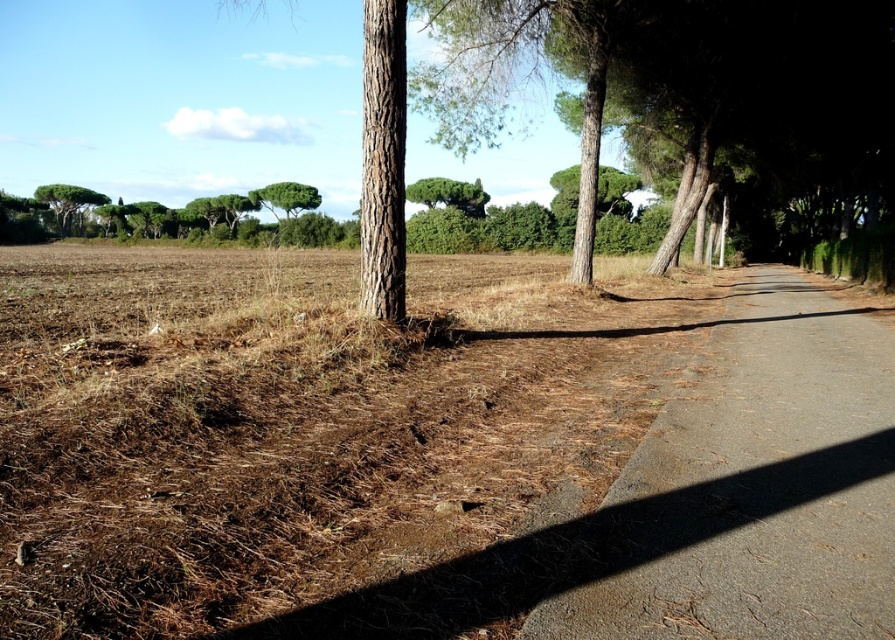
Question: Can you confirm if brown dry grass at lower left is smaller than gray concrete path at center-right?

Choices:
 (A) yes
 (B) no

Answer: (B)

Question: Among these points, which one is nearest to the camera?

Choices:
 (A) tap(413, 186)
 (B) tap(74, 198)

Answer: (A)

Question: Is brown dry grass at lower left further to the viewer compared to green leafy tree at center?

Choices:
 (A) no
 (B) yes

Answer: (A)

Question: Can you confirm if brown dry grass at lower left is positioned to the left of green leafy tree at center?

Choices:
 (A) no
 (B) yes

Answer: (B)

Question: Which object appears farthest from the camera in this image?

Choices:
 (A) brown dry grass at lower left
 (B) green leafy tree at center
 (C) gray concrete path at center-right

Answer: (B)

Question: Based on their relative distances, which object is farther from the green leafy tree at upper left?

Choices:
 (A) green leafy tree at center
 (B) brown dry grass at lower left
 (C) gray concrete path at center-right

Answer: (C)